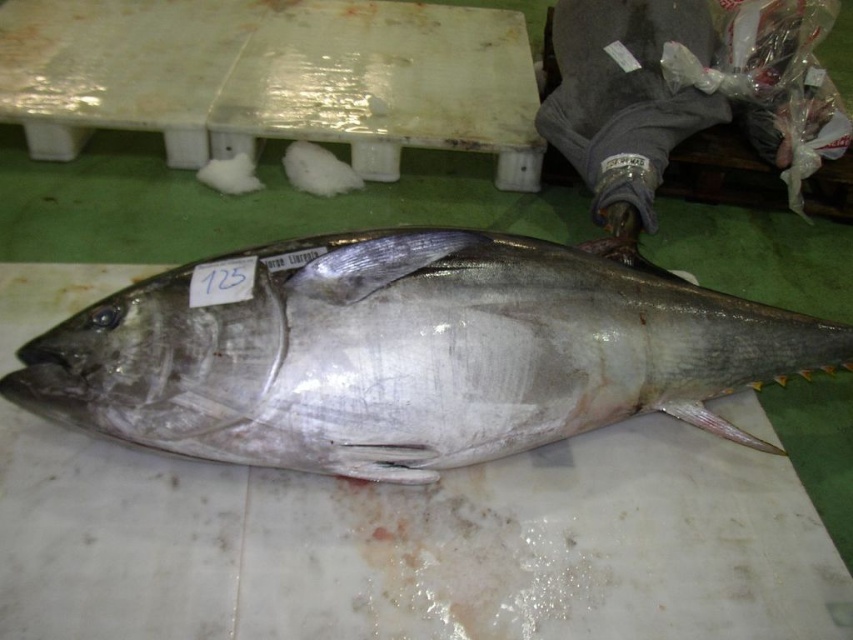
Question: Among these points, which one is nearest to the camera?

Choices:
 (A) (544, 321)
 (B) (410, 120)

Answer: (A)

Question: Is shiny silver fish at center further to the viewer compared to white plastic table at center?

Choices:
 (A) yes
 (B) no

Answer: (B)

Question: Does shiny silver fish at center appear over white plastic table at center?

Choices:
 (A) no
 (B) yes

Answer: (A)

Question: Which point is farther from the camera taking this photo?

Choices:
 (A) (25, 374)
 (B) (395, 113)

Answer: (B)

Question: From the image, what is the correct spatial relationship of shiny silver fish at center in relation to white plastic table at center?

Choices:
 (A) right
 (B) left

Answer: (A)